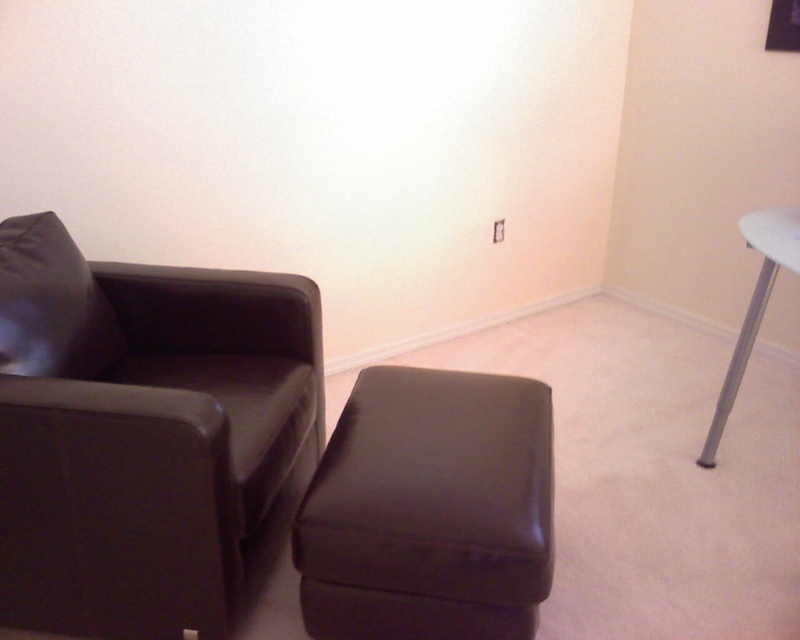
Question: Considering the relative positions of matte black ottoman at center and matte black pillow at left in the image provided, where is matte black ottoman at center located with respect to matte black pillow at left?

Choices:
 (A) above
 (B) below

Answer: (B)

Question: Can you confirm if matte brown leather swivel chair at left is smaller than matte black pillow at left?

Choices:
 (A) yes
 (B) no

Answer: (B)

Question: Does matte brown leather swivel chair at left lie in front of matte black ottoman at center?

Choices:
 (A) yes
 (B) no

Answer: (A)

Question: Which point is farther to the camera?

Choices:
 (A) matte black ottoman at center
 (B) matte black pillow at left
 (C) matte brown leather swivel chair at left

Answer: (B)

Question: Which is farther from the matte brown leather swivel chair at left?

Choices:
 (A) matte black ottoman at center
 (B) matte black pillow at left

Answer: (A)

Question: Which object appears farthest from the camera in this image?

Choices:
 (A) matte black ottoman at center
 (B) matte black pillow at left
 (C) matte brown leather swivel chair at left

Answer: (B)